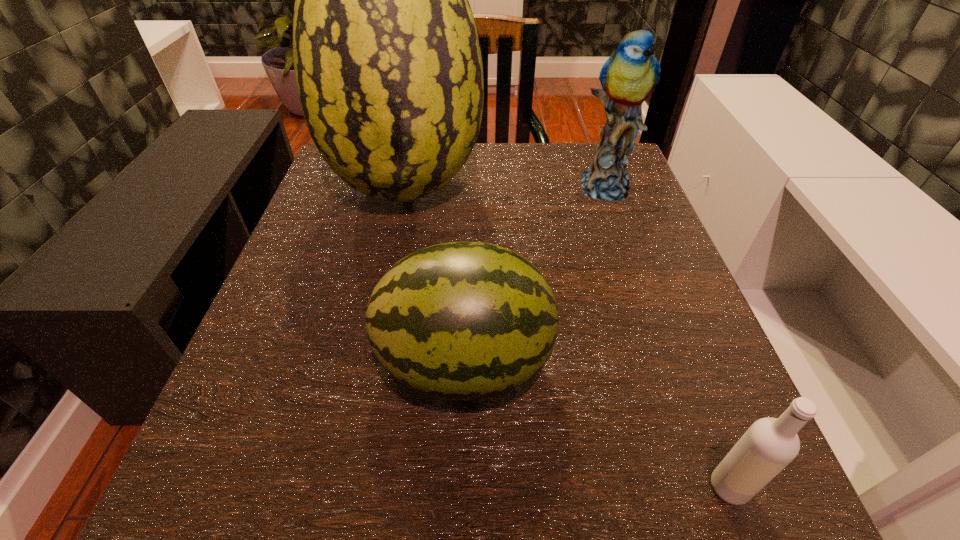
Identify the location of watermelon that is at the far edge. The width and height of the screenshot is (960, 540). (388, 66).

Find the location of `parrot that is at the far edge`. parrot that is at the far edge is located at coordinates (628, 77).

Find the location of `object present at the near edge`. object present at the near edge is located at coordinates (770, 444).

Identify the location of object at the left edge. [388, 66].

The image size is (960, 540). What are the coordinates of `parrot at the right edge` in the screenshot? It's located at (628, 77).

At what (x,y) coordinates should I click in order to perform the action: click on vodka that is at the right edge. Please return your answer as a coordinate pair (x, y). The width and height of the screenshot is (960, 540). Looking at the image, I should click on (770, 444).

You are a GUI agent. You are given a task and a screenshot of the screen. Output one action in this format:
    pyautogui.click(x=<x>, y=<y>)
    Task: Click on the object situated at the far left corner
    
    Given the screenshot: What is the action you would take?
    pyautogui.click(x=388, y=66)

The height and width of the screenshot is (540, 960). I want to click on object that is at the far right corner, so (628, 77).

Where is `object at the near right corner`? object at the near right corner is located at coordinates (770, 444).

This screenshot has height=540, width=960. In order to click on free point at the far edge in this screenshot , I will do `click(530, 165)`.